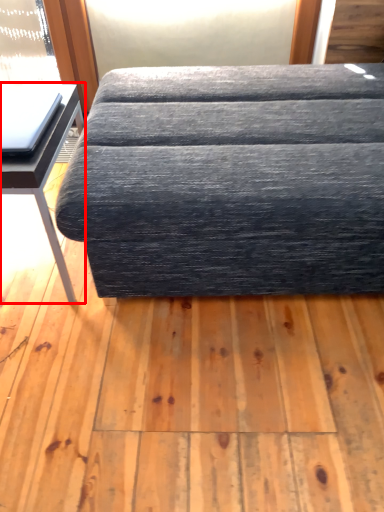
Question: From the image's perspective, considering the relative positions of table (annotated by the red box) and studio couch in the image provided, where is table (annotated by the red box) located with respect to the staircase?

Choices:
 (A) above
 (B) below

Answer: (B)